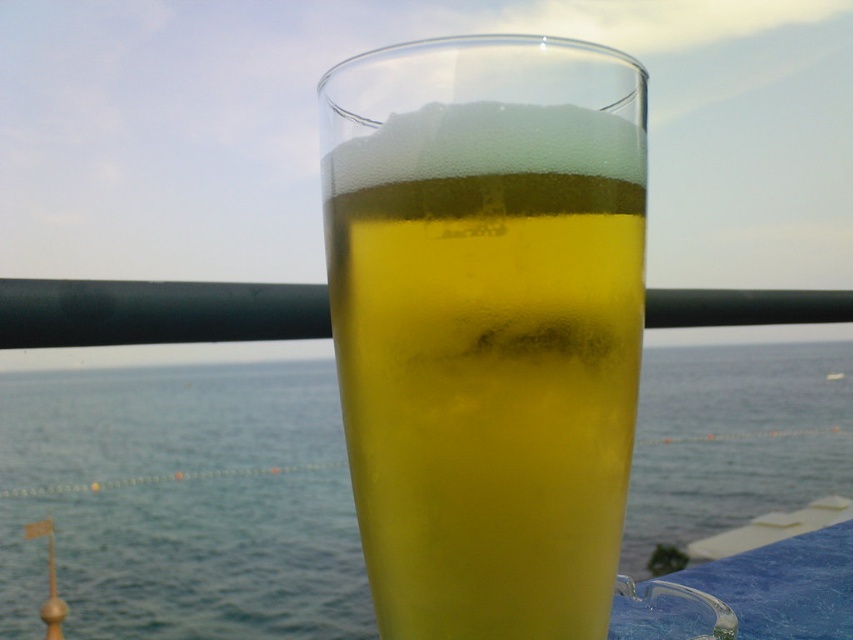
Image resolution: width=853 pixels, height=640 pixels. I want to click on translucent glass at center, so click(486, 324).

You are a GUI agent. You are given a task and a screenshot of the screen. Output one action in this format:
    pyautogui.click(x=<x>, y=<y>)
    Task: Click on the translucent glass at center
    This screenshot has width=853, height=640.
    Given the screenshot: What is the action you would take?
    pyautogui.click(x=486, y=324)